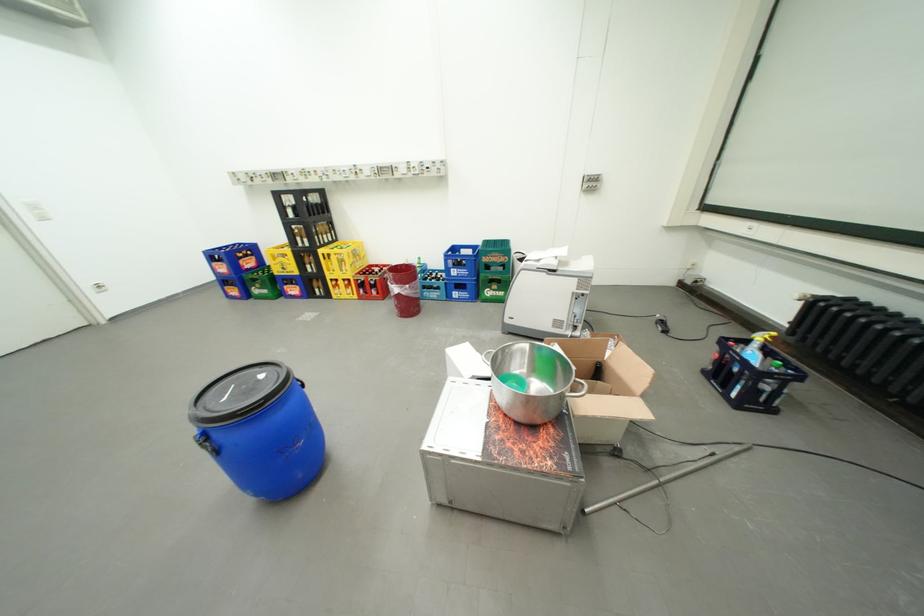
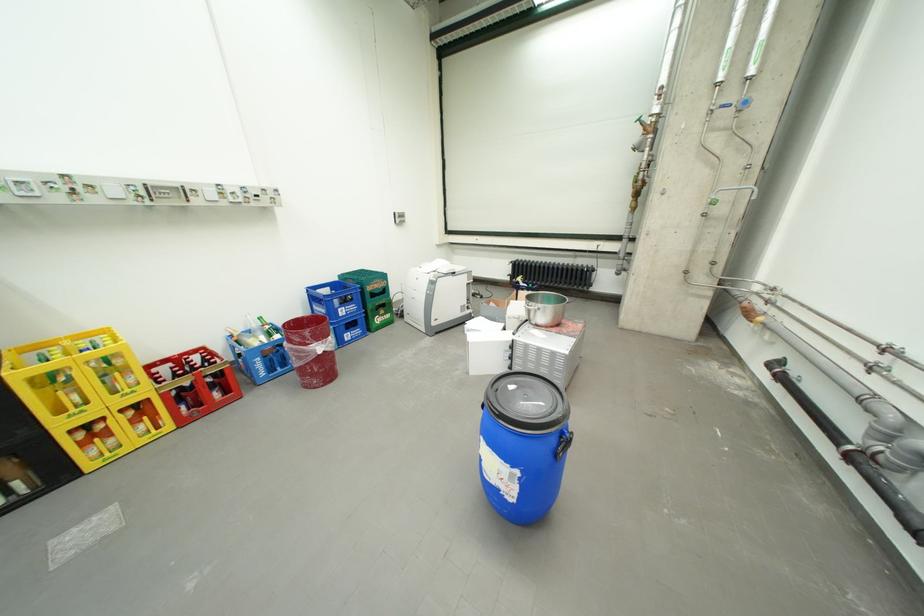
Find the pixel in the second image that matches the point at 332,252 in the first image.

(30, 374)